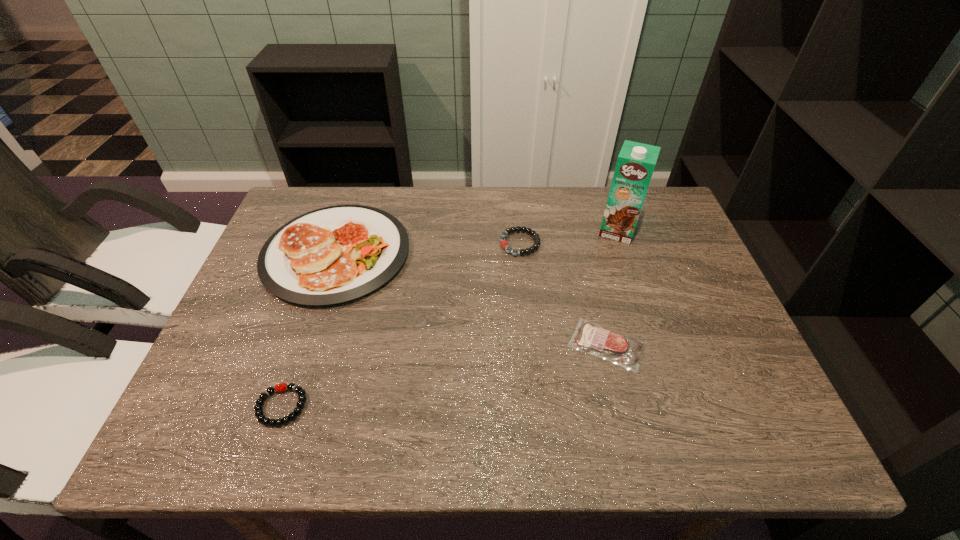
Identify the location of the closest object to the nearer bracelet. This screenshot has height=540, width=960. (332, 255).

At what (x,y) coordinates should I click in order to perform the action: click on object that is the third closest to the farther bracelet. Please return your answer as a coordinate pair (x, y). Image resolution: width=960 pixels, height=540 pixels. Looking at the image, I should click on (332, 255).

Where is `free space that satisfies the following two spatial constraints: 1. on the back side of the fourth farthest object; 2. on the right side of the nearest object`? free space that satisfies the following two spatial constraints: 1. on the back side of the fourth farthest object; 2. on the right side of the nearest object is located at coordinates (302, 345).

This screenshot has width=960, height=540. Find the location of `free location that satisfies the following two spatial constraints: 1. on the front side of the second nearest object; 2. on the right side of the farther bracelet`. free location that satisfies the following two spatial constraints: 1. on the front side of the second nearest object; 2. on the right side of the farther bracelet is located at coordinates (529, 345).